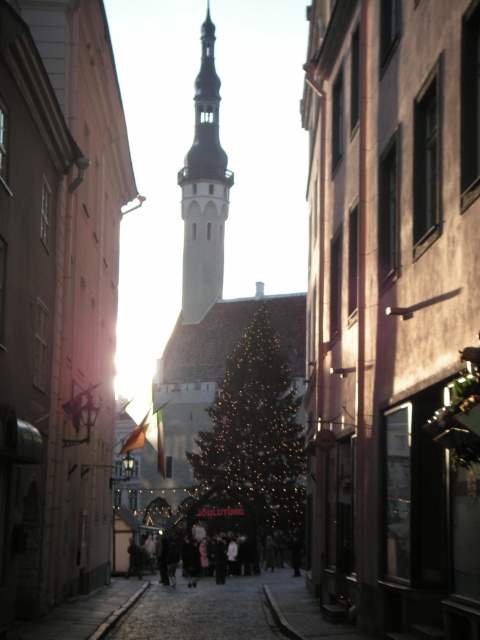
You are standing at the entrance of the street and want to take a photo of the smooth stone bell tower at center. Which direction should you face to ensure the tower is in the frame?

The smooth stone bell tower at center is located at point (204, 192), so you should face towards the center of the street to capture it in your photo.

You are standing at the entrance of the historic town and want to locate the illuminated gold christmas tree at center. According to the map, your current position is at point 0.5, 0.5. Can you determine the direction you need to walk to reach it?

The illuminated gold christmas tree at center is located at point [252,436]. Since your current position is at [240,320], you should walk northeast to reach it.

You are a tourist standing on the cobblestone street and want to take a photo of the illuminated gold christmas tree at center and the dark clothing at center. Which object should you focus on first to ensure both are in the frame?

You should focus on the illuminated gold christmas tree at center first because it is closer to you than the dark clothing at center, ensuring both are in the frame.